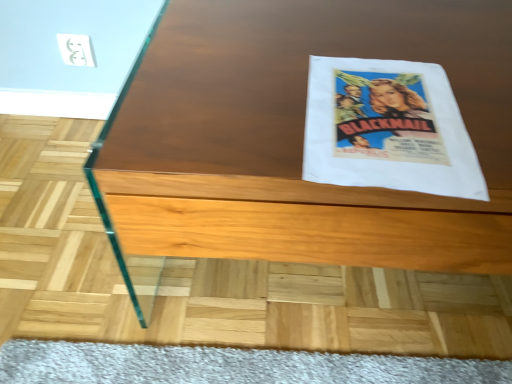
In order to click on empty space that is ontop of wooden table at center (from a real-world perspective) in this screenshot , I will do `click(342, 62)`.